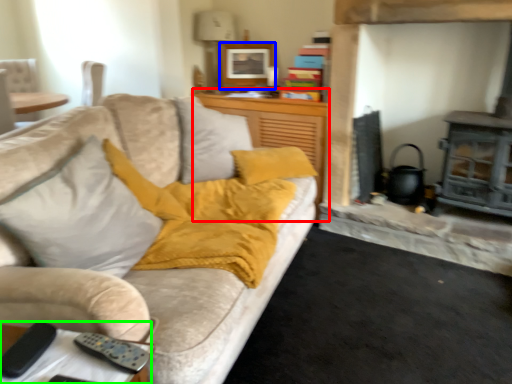
Question: Which is farther away from dresser (highlighted by a red box)? picture frame (highlighted by a blue box) or table (highlighted by a green box)?

Choices:
 (A) picture frame
 (B) table

Answer: (B)